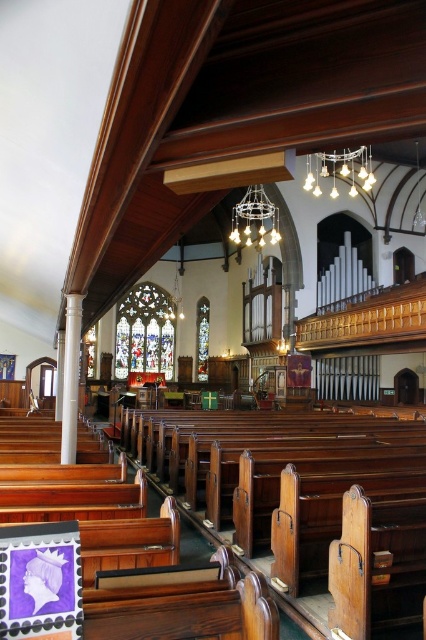
Question: Which point is closer to the camera?

Choices:
 (A) matte glass chandelier at upper center
 (B) matte glass chandelier at center

Answer: (A)

Question: Which point is farther to the camera?

Choices:
 (A) (314, 184)
 (B) (241, 240)

Answer: (B)

Question: Is matte glass chandelier at upper center closer to the viewer compared to matte glass chandelier at center?

Choices:
 (A) yes
 (B) no

Answer: (A)

Question: Does matte glass chandelier at upper center appear under matte glass chandelier at center?

Choices:
 (A) no
 (B) yes

Answer: (B)

Question: Is matte glass chandelier at upper center closer to camera compared to matte glass chandelier at center?

Choices:
 (A) no
 (B) yes

Answer: (B)